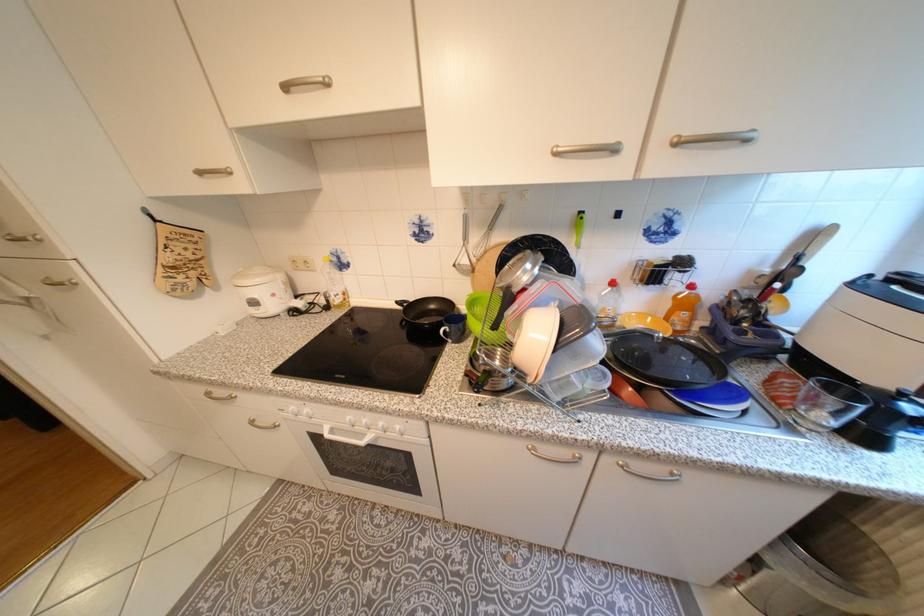
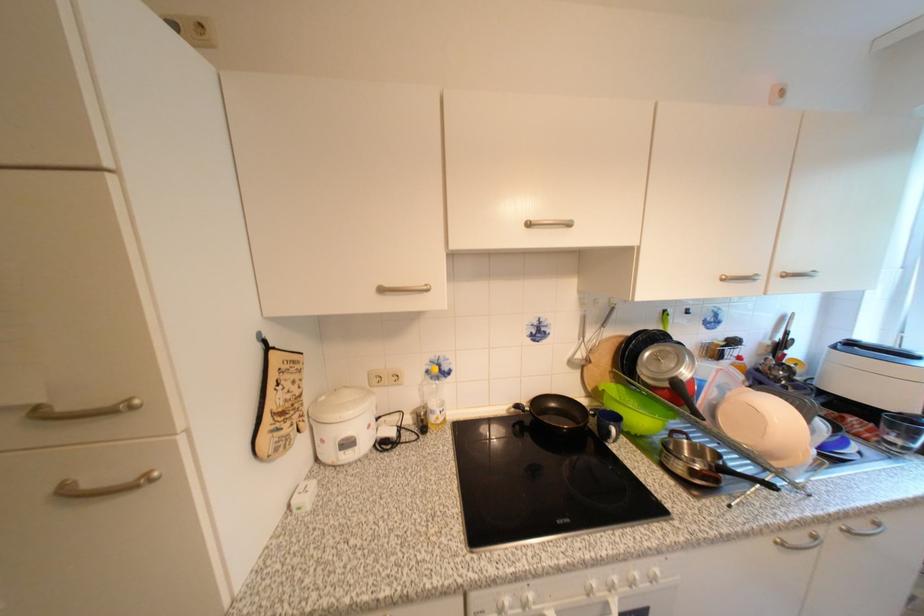
Where in the second image is the point corresponding to [210,174] from the first image?

(391, 291)